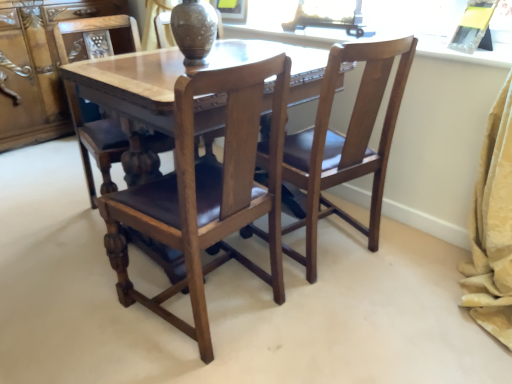
Question: Does polished wood chair at center, the 2th chair when ordered from right to left, lie behind wooden chair at center, which appears as the third chair when viewed from the left?

Choices:
 (A) no
 (B) yes

Answer: (A)

Question: Is polished wood chair at center, the 2th chair when ordered from right to left, closer to the viewer compared to wooden chair at center, which appears as the first chair when viewed from the right?

Choices:
 (A) yes
 (B) no

Answer: (A)

Question: Is polished wood chair at center, the 2th chair when ordered from right to left, facing away from wooden chair at center, which appears as the first chair when viewed from the right?

Choices:
 (A) no
 (B) yes

Answer: (A)

Question: From a real-world perspective, is polished wood chair at center, the 2th chair when ordered from right to left, beneath wooden chair at center, which appears as the third chair when viewed from the left?

Choices:
 (A) yes
 (B) no

Answer: (B)

Question: Is polished wood chair at center, the 2th chair when ordered from right to left, wider than wooden chair at center, which appears as the third chair when viewed from the left?

Choices:
 (A) no
 (B) yes

Answer: (B)

Question: Can you confirm if polished wood chair at center, the 2th chair positioned from the left, is taller than wooden chair at center, which appears as the third chair when viewed from the left?

Choices:
 (A) no
 (B) yes

Answer: (B)

Question: Is brown leather chair at center, which is counted as the first chair, starting from the left, beside wooden chair at center, which appears as the first chair when viewed from the right?

Choices:
 (A) no
 (B) yes

Answer: (A)

Question: Does brown leather chair at center, which is counted as the first chair, starting from the left, lie in front of wooden chair at center, which appears as the first chair when viewed from the right?

Choices:
 (A) no
 (B) yes

Answer: (A)

Question: Is brown leather chair at center, positioned as the 3th chair in right-to-left order, behind wooden chair at center, which appears as the third chair when viewed from the left?

Choices:
 (A) yes
 (B) no

Answer: (A)

Question: From the image's perspective, is brown leather chair at center, positioned as the 3th chair in right-to-left order, under wooden chair at center, which appears as the third chair when viewed from the left?

Choices:
 (A) yes
 (B) no

Answer: (B)

Question: Considering the relative sizes of brown leather chair at center, positioned as the 3th chair in right-to-left order, and wooden chair at center, which appears as the first chair when viewed from the right, in the image provided, is brown leather chair at center, positioned as the 3th chair in right-to-left order, thinner than wooden chair at center, which appears as the first chair when viewed from the right,?

Choices:
 (A) no
 (B) yes

Answer: (A)

Question: Is wooden chair at center, which appears as the first chair when viewed from the right, inside brown leather chair at center, which is counted as the first chair, starting from the left?

Choices:
 (A) no
 (B) yes

Answer: (A)

Question: Could you tell me if brown matte vase at center is turned towards wooden cabinet at left?

Choices:
 (A) no
 (B) yes

Answer: (A)